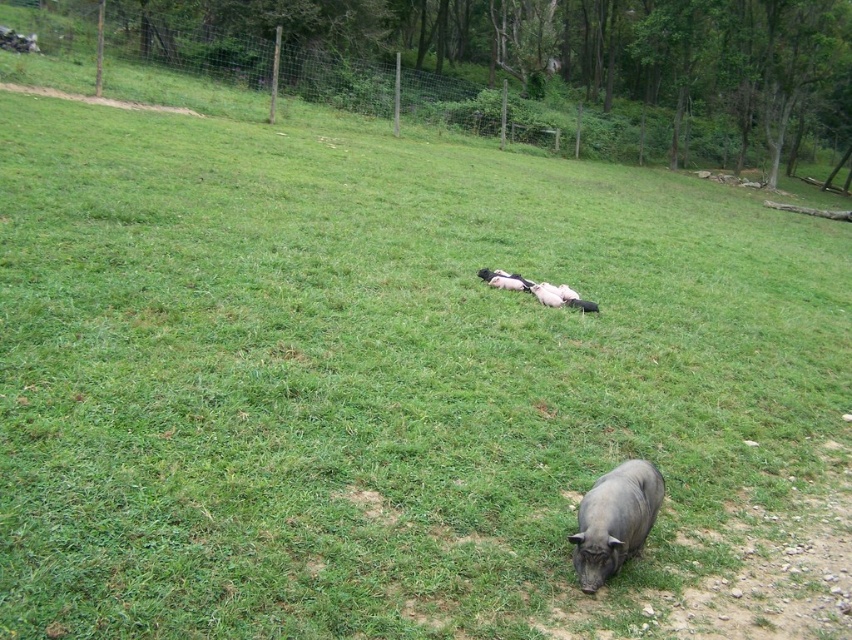
Can you confirm if gray matte pig at lower center is taller than pink soft piglets at center?

Yes.

Looking at this image, can you confirm if gray matte pig at lower center is thinner than pink soft piglets at center?

Yes, gray matte pig at lower center is thinner than pink soft piglets at center.

Does point (626, 508) lie behind point (513, 276)?

No, it is in front of (513, 276).

I want to click on gray matte pig at lower center, so click(614, 520).